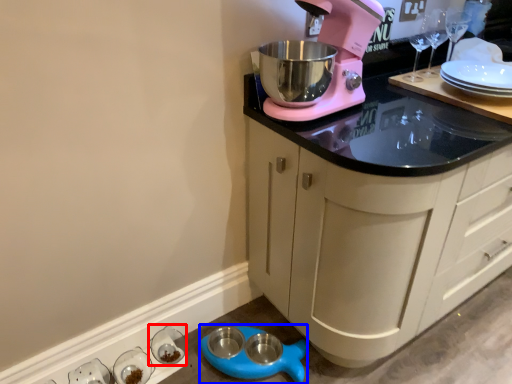
Question: Among these objects, which one is nearest to the camera, tableware (highlighted by a red box) or appliance (highlighted by a blue box)?

Choices:
 (A) tableware
 (B) appliance

Answer: (B)